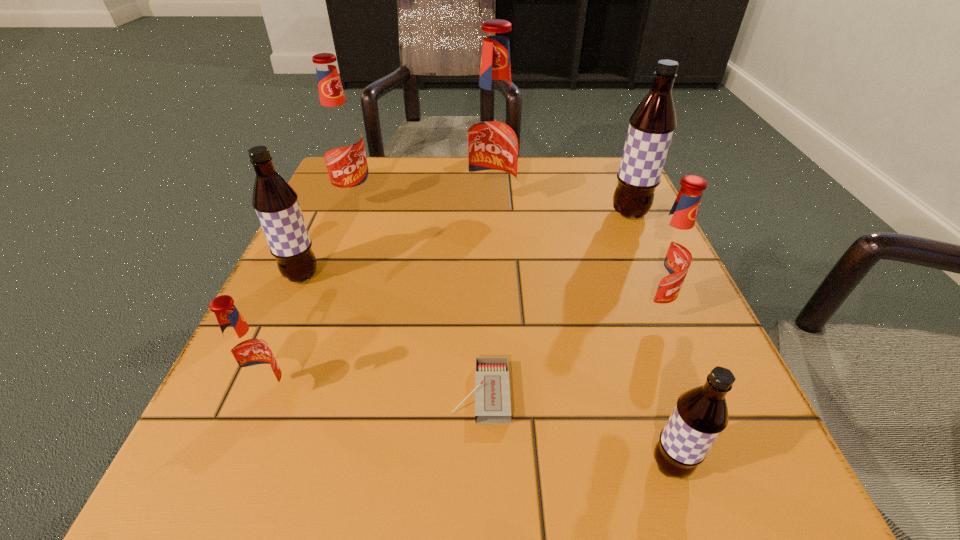
Find the location of a particular element. The height and width of the screenshot is (540, 960). the fourth root beer from right to left is located at coordinates (494, 130).

What are the coordinates of `the tallest root beer` in the screenshot? It's located at (494, 130).

I want to click on the third smallest red root beer, so click(x=341, y=140).

This screenshot has width=960, height=540. I want to click on the farthest brown root beer, so click(x=652, y=125).

At what (x,y) coordinates should I click in order to perform the action: click on the biggest brown root beer. Please return your answer as a coordinate pair (x, y). The width and height of the screenshot is (960, 540). Looking at the image, I should click on (652, 125).

What are the coordinates of `the fourth farthest object` in the screenshot? It's located at (276, 203).

This screenshot has width=960, height=540. What are the coordinates of `the fourth farthest root beer` in the screenshot? It's located at (276, 203).

What are the coordinates of `the rightmost red root beer` in the screenshot? It's located at (668, 255).

Find the location of a particular element. This screenshot has height=540, width=960. the third farthest red root beer is located at coordinates (668, 255).

I want to click on the nearest red root beer, so click(248, 355).